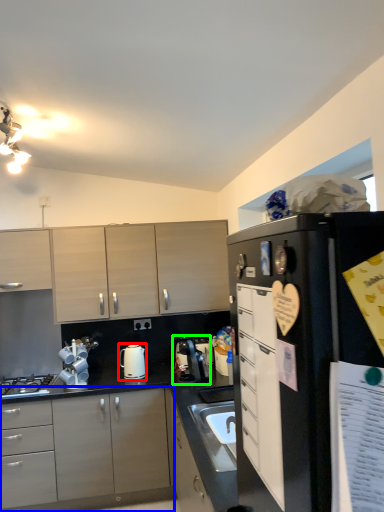
Question: Based on their relative distances, which object is nearer to kitchen appliance (highlighted by a red box)? Choose from cabinetry (highlighted by a blue box) and coffee machine (highlighted by a green box).

Choices:
 (A) cabinetry
 (B) coffee machine

Answer: (B)